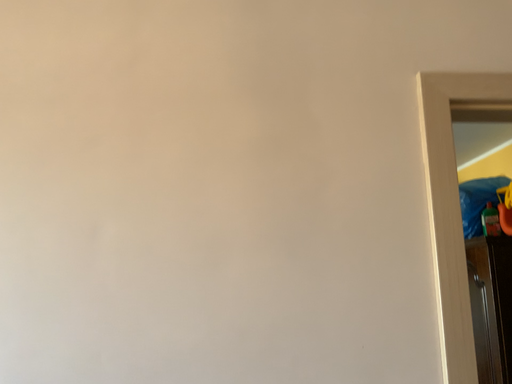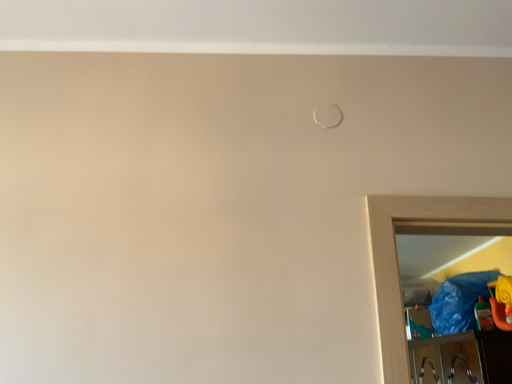
Question: Which way did the camera rotate in the video?

Choices:
 (A) rotated downward
 (B) rotated upward

Answer: (B)